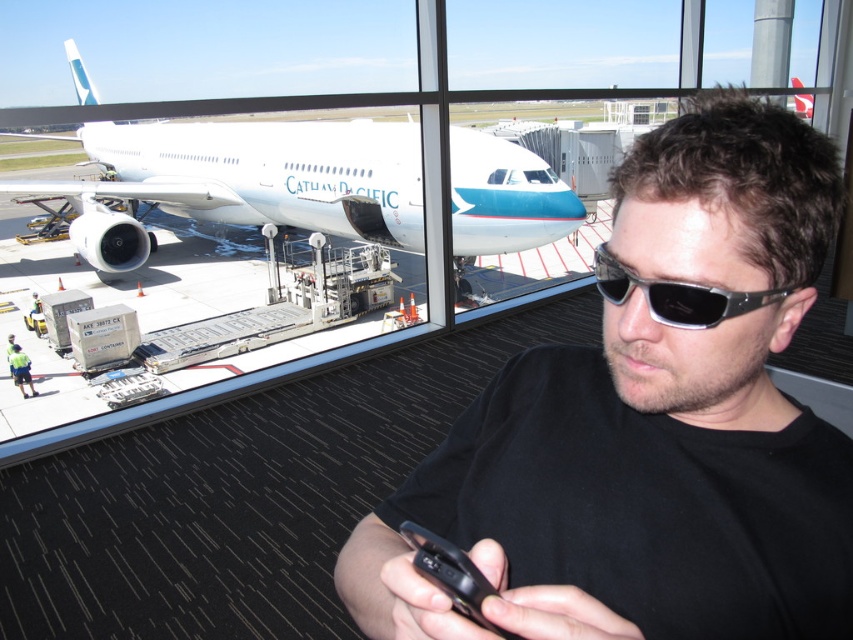
Which of these two, black matte shirt at center or sunglasses at center, stands shorter?

With less height is sunglasses at center.

Is black matte shirt at center smaller than sunglasses at center?

Incorrect, black matte shirt at center is not smaller in size than sunglasses at center.

Locate an element on the screen. Image resolution: width=853 pixels, height=640 pixels. black matte shirt at center is located at coordinates (651, 422).

Is the position of black matte shirt at center less distant than that of white glossy airplane at upper left?

Yes, it is.

Between black matte shirt at center and white glossy airplane at upper left, which one is positioned higher?

white glossy airplane at upper left is higher up.

Describe the element at coordinates (651, 422) in the screenshot. I see `black matte shirt at center` at that location.

Where is `black matte shirt at center`? This screenshot has width=853, height=640. black matte shirt at center is located at coordinates (651, 422).

Is white glossy airplane at upper left further to the viewer compared to sunglasses at center?

Yes, white glossy airplane at upper left is behind sunglasses at center.

Does white glossy airplane at upper left have a greater width compared to sunglasses at center?

Yes.

Is point (421, 193) less distant than point (679, 300)?

No, it is behind (679, 300).

Locate an element on the screen. This screenshot has width=853, height=640. white glossy airplane at upper left is located at coordinates (263, 173).